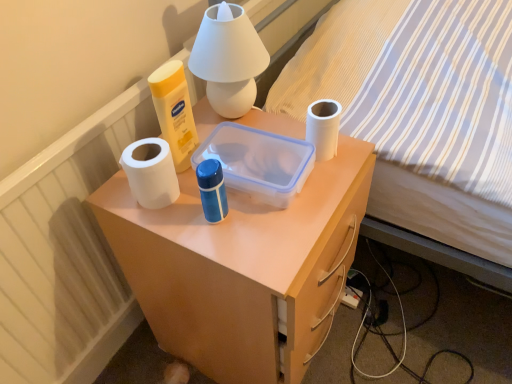
Question: Can you confirm if white matte toilet paper at right is positioned to the left of white matte desk at center?

Choices:
 (A) yes
 (B) no

Answer: (B)

Question: Can you confirm if white matte toilet paper at right is thinner than white matte desk at center?

Choices:
 (A) yes
 (B) no

Answer: (A)

Question: Does white matte toilet paper at right have a smaller size compared to white matte desk at center?

Choices:
 (A) yes
 (B) no

Answer: (A)

Question: From the image's perspective, is white matte toilet paper at right located above white matte desk at center?

Choices:
 (A) yes
 (B) no

Answer: (A)

Question: Is white matte toilet paper at right bigger than white matte desk at center?

Choices:
 (A) no
 (B) yes

Answer: (A)

Question: In terms of height, does striped fabric bed at upper right look taller or shorter compared to white matte toilet paper at right?

Choices:
 (A) short
 (B) tall

Answer: (B)

Question: Is point (476, 221) closer or farther from the camera than point (316, 107)?

Choices:
 (A) farther
 (B) closer

Answer: (A)

Question: From a real-world perspective, is striped fabric bed at upper right above or below white matte toilet paper at right?

Choices:
 (A) above
 (B) below

Answer: (B)

Question: Would you say striped fabric bed at upper right is to the left or to the right of white matte toilet paper at right in the picture?

Choices:
 (A) right
 (B) left

Answer: (A)

Question: Considering their positions, is white matte desk at center located in front of or behind white matte table lamp at upper center?

Choices:
 (A) behind
 (B) front

Answer: (B)

Question: Is white matte desk at center inside the boundaries of white matte table lamp at upper center, or outside?

Choices:
 (A) inside
 (B) outside

Answer: (B)

Question: Does point (306, 317) appear closer or farther from the camera than point (264, 69)?

Choices:
 (A) farther
 (B) closer

Answer: (B)

Question: From the image's perspective, is white matte desk at center above or below white matte table lamp at upper center?

Choices:
 (A) above
 (B) below

Answer: (B)

Question: Considering the positions of striped fabric bed at upper right and white matte table lamp at upper center in the image, is striped fabric bed at upper right taller or shorter than white matte table lamp at upper center?

Choices:
 (A) tall
 (B) short

Answer: (A)

Question: In terms of size, does striped fabric bed at upper right appear bigger or smaller than white matte table lamp at upper center?

Choices:
 (A) small
 (B) big

Answer: (B)